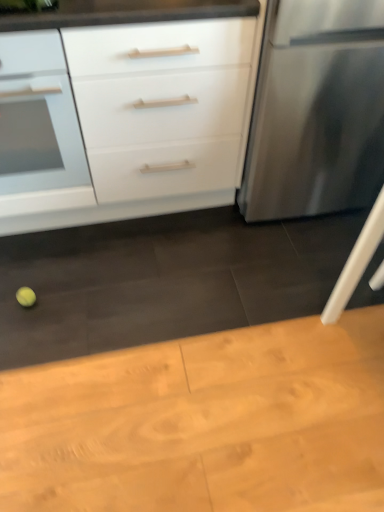
Question: Considering the positions of yellow matte tennis ball at lower left and white matte drawer at upper left, the 1th drawer in the front-to-back sequence, in the image, is yellow matte tennis ball at lower left wider or thinner than white matte drawer at upper left, the 1th drawer in the front-to-back sequence,?

Choices:
 (A) thin
 (B) wide

Answer: (A)

Question: From a real-world perspective, is yellow matte tennis ball at lower left physically located above or below white matte drawer at upper left, which is the 2th drawer in back-to-front order?

Choices:
 (A) above
 (B) below

Answer: (B)

Question: Estimate the real-world distances between objects in this image. Which object is farther from the stainless steel refrigerator at right?

Choices:
 (A) white matte drawer at upper left, which is the 2th drawer in back-to-front order
 (B) yellow matte tennis ball at lower left
 (C) white matte drawer at left, which is the second drawer from front to back
 (D) white matte cabinet at center
 (E) wooden table at lower center

Answer: (B)

Question: Which object is positioned farthest from the white matte drawer at left, which is the second drawer from front to back?

Choices:
 (A) yellow matte tennis ball at lower left
 (B) stainless steel refrigerator at right
 (C) white matte cabinet at center
 (D) white matte drawer at upper left, which is the 2th drawer in back-to-front order
 (E) wooden table at lower center

Answer: (E)